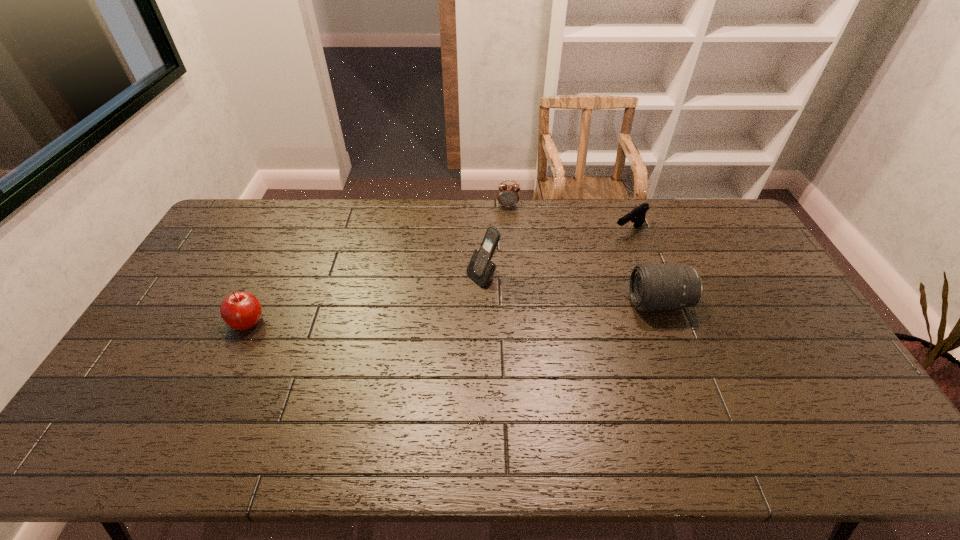
Where is `free spot on the desktop that is between the leftmost object and the telephoto lens and is positioned on the face of the alarm clock`? free spot on the desktop that is between the leftmost object and the telephoto lens and is positioned on the face of the alarm clock is located at coordinates (508, 310).

Identify the location of free space on the desktop that is between the leftmost object and the telephoto lens and is positioned on the front-facing side of the fourth object from right to left. (419, 314).

At what (x,y) coordinates should I click in order to perform the action: click on free space on the desktop that is between the leftmost object and the telephoto lens and is positioned on the front-facing side of the pistol. Please return your answer as a coordinate pair (x, y). The image size is (960, 540). Looking at the image, I should click on (511, 310).